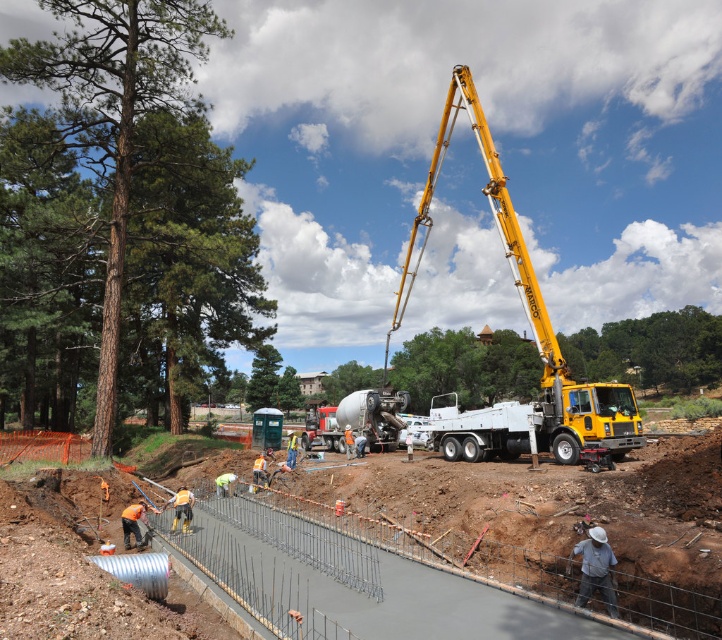
Question: Which of these objects is positioned closest to the white metallic truck at center?

Choices:
 (A) matte concrete mixer at center
 (B) yellow metallic crane at center
 (C) smooth concrete slab at center

Answer: (C)

Question: Is smooth concrete slab at center below white metallic truck at center?

Choices:
 (A) no
 (B) yes

Answer: (A)

Question: Is yellow metallic crane at center wider than matte concrete mixer at center?

Choices:
 (A) no
 (B) yes

Answer: (B)

Question: Is smooth concrete slab at center smaller than yellow metallic crane at center?

Choices:
 (A) no
 (B) yes

Answer: (B)

Question: Which point is farther from the camera taking this photo?

Choices:
 (A) (677, 612)
 (B) (339, 451)
 (C) (588, 397)
 (D) (404, 292)

Answer: (D)

Question: Which point appears farthest from the camera in this image?

Choices:
 (A) (549, 426)
 (B) (383, 419)
 (C) (487, 412)
 (D) (690, 500)

Answer: (B)